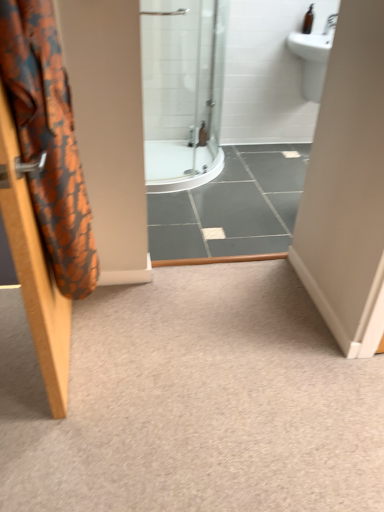
The width and height of the screenshot is (384, 512). Describe the element at coordinates (48, 140) in the screenshot. I see `orange fabric shower curtain at left` at that location.

You are a GUI agent. You are given a task and a screenshot of the screen. Output one action in this format:
    pyautogui.click(x=<x>, y=<y>)
    Task: Click on the brown glass bottle at upper right
    The width and height of the screenshot is (384, 512).
    Given the screenshot: What is the action you would take?
    pyautogui.click(x=308, y=20)

Considering the sizes of objects carpet at center and orange fabric shower curtain at left in the image provided, who is wider, carpet at center or orange fabric shower curtain at left?

With larger width is carpet at center.

From a real-world perspective, is carpet at center over orange fabric shower curtain at left?

Actually, carpet at center is physically below orange fabric shower curtain at left in the real world.

Which is closer, (x=73, y=505) or (x=32, y=98)?

The point (x=32, y=98) is more forward.

Considering the relative sizes of carpet at center and orange fabric shower curtain at left in the image provided, is carpet at center shorter than orange fabric shower curtain at left?

Indeed, carpet at center has a lesser height compared to orange fabric shower curtain at left.

Is brown glass bottle at upper right looking in the opposite direction of orange fabric shower curtain at left?

No, brown glass bottle at upper right is not facing away from orange fabric shower curtain at left.

Who is bigger, brown glass bottle at upper right or orange fabric shower curtain at left?

orange fabric shower curtain at left is bigger.

Locate an element on the screen. toiletry lying on the right of orange fabric shower curtain at left is located at coordinates (308, 20).

Which is more to the left, brown glass bottle at upper right or carpet at center?

Positioned to the left is carpet at center.

Considering the sizes of brown glass bottle at upper right and carpet at center in the image, is brown glass bottle at upper right bigger or smaller than carpet at center?

In the image, brown glass bottle at upper right appears to be smaller than carpet at center.

This screenshot has height=512, width=384. Find the location of `plain to the left of brown glass bottle at upper right`. plain to the left of brown glass bottle at upper right is located at coordinates (193, 401).

Looking at this image, how distant is brown glass bottle at upper right from carpet at center?

9.32 feet.

Is orange fabric shower curtain at left inside the boundaries of brown glass bottle at upper right, or outside?

orange fabric shower curtain at left is not inside brown glass bottle at upper right, it's outside.

Is orange fabric shower curtain at left facing towards brown glass bottle at upper right?

No, orange fabric shower curtain at left does not turn towards brown glass bottle at upper right.

Which object is positioned more to the right, orange fabric shower curtain at left or brown glass bottle at upper right?

From the viewer's perspective, brown glass bottle at upper right appears more on the right side.

Between point (379, 414) and point (307, 32), which one is positioned in front?

Point (379, 414)

From a real-world perspective, is carpet at center beneath brown glass bottle at upper right?

Yes.

From the image's perspective, is carpet at center on top of brown glass bottle at upper right?

Actually, carpet at center appears below brown glass bottle at upper right in the image.

Is orange fabric shower curtain at left not near carpet at center?

No, there isn't a large distance between orange fabric shower curtain at left and carpet at center.

Between point (41, 42) and point (316, 370), which one is positioned in front?

Positioned in front is point (41, 42).

In terms of width, does orange fabric shower curtain at left look wider or thinner when compared to carpet at center?

Clearly, orange fabric shower curtain at left has less width compared to carpet at center.

From the picture: From the image's perspective, is orange fabric shower curtain at left below carpet at center?

No, from the image's perspective, orange fabric shower curtain at left is not beneath carpet at center.

Locate an element on the screen. plain to the right of orange fabric shower curtain at left is located at coordinates coord(193,401).

Locate an element on the screen. This screenshot has width=384, height=512. toiletry that is above the orange fabric shower curtain at left (from a real-world perspective) is located at coordinates (308, 20).

Considering their positions, is brown glass bottle at upper right positioned closer to carpet at center than orange fabric shower curtain at left?

orange fabric shower curtain at left is closer to carpet at center.

From the image, which object appears to be farther from brown glass bottle at upper right, carpet at center or orange fabric shower curtain at left?

Based on the image, orange fabric shower curtain at left appears to be further to brown glass bottle at upper right.

From the image, which object appears to be nearer to orange fabric shower curtain at left, brown glass bottle at upper right or carpet at center?

Among the two, carpet at center is located nearer to orange fabric shower curtain at left.

Considering their positions, is carpet at center positioned closer to orange fabric shower curtain at left than brown glass bottle at upper right?

The object closer to orange fabric shower curtain at left is carpet at center.

Which object lies nearer to the anchor point brown glass bottle at upper right, orange fabric shower curtain at left or carpet at center?

Based on the image, carpet at center appears to be nearer to brown glass bottle at upper right.

Consider the image. Considering their positions, is orange fabric shower curtain at left positioned further to carpet at center than brown glass bottle at upper right?

Based on the image, brown glass bottle at upper right appears to be further to carpet at center.

Locate an element on the screen. plain between orange fabric shower curtain at left and brown glass bottle at upper right in the front-back direction is located at coordinates (193, 401).